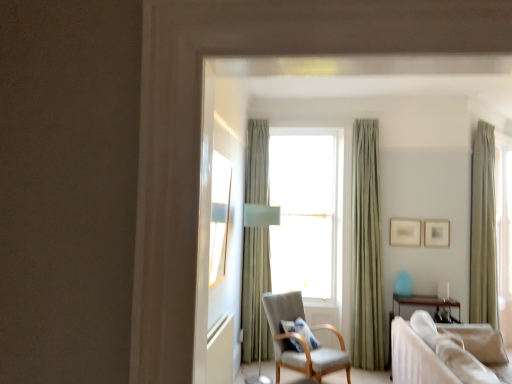
You are a GUI agent. You are given a task and a screenshot of the screen. Output one action in this format:
    pyautogui.click(x=<x>, y=<y>)
    Task: Click on the blue cotton pillow at center
    
    Given the screenshot: What is the action you would take?
    pyautogui.click(x=301, y=331)

What do you see at coordinates (301, 340) in the screenshot? I see `light gray fabric chair at center` at bounding box center [301, 340].

What is the approximate width of light gray fabric chair at center?

light gray fabric chair at center is 34.68 inches in width.

Where is `matte gold picture frame at center right, placed as the 2th picture frame when sorted from right to left`? The width and height of the screenshot is (512, 384). matte gold picture frame at center right, placed as the 2th picture frame when sorted from right to left is located at coordinates (405, 232).

This screenshot has height=384, width=512. Describe the element at coordinates (483, 229) in the screenshot. I see `green velvet curtain at right, which is the 1th curtain in right-to-left order` at that location.

You are a GUI agent. You are given a task and a screenshot of the screen. Output one action in this format:
    pyautogui.click(x=<x>, y=<y>)
    Task: Click on the teal glass vase at center-right
    This screenshot has height=384, width=512.
    Given the screenshot: What is the action you would take?
    click(x=404, y=284)

Image resolution: width=512 pixels, height=384 pixels. I want to click on sage green fabric curtain at center, acting as the 2th curtain starting from the left, so click(366, 251).

Is point (393, 341) closer to viewer compared to point (402, 224)?

Yes.

Are beige fabric couch at lower right and matte gold picture frame at center right, placed as the 2th picture frame when sorted from right to left, making contact?

No, beige fabric couch at lower right is not making contact with matte gold picture frame at center right, placed as the 2th picture frame when sorted from right to left.

Is beige fabric couch at lower right outside of matte gold picture frame at center right, which is the first picture frame from left to right?

Indeed, beige fabric couch at lower right is completely outside matte gold picture frame at center right, which is the first picture frame from left to right.

Consider the image. Based on their sizes in the image, would you say green fabric curtain at center, which ranks as the 3th curtain in right-to-left order, is bigger or smaller than light gray fabric chair at center?

green fabric curtain at center, which ranks as the 3th curtain in right-to-left order, is smaller than light gray fabric chair at center.

Considering the positions of objects green fabric curtain at center, the first curtain positioned from the left, and light gray fabric chair at center in the image provided, who is in front, green fabric curtain at center, the first curtain positioned from the left, or light gray fabric chair at center?

light gray fabric chair at center.

Can you confirm if green fabric curtain at center, which ranks as the 3th curtain in right-to-left order, is thinner than light gray fabric chair at center?

Yes.

Can you confirm if green fabric curtain at center, the first curtain positioned from the left, is shorter than light gray fabric chair at center?

Incorrect, the height of green fabric curtain at center, the first curtain positioned from the left, does not fall short of that of light gray fabric chair at center.

How much distance is there between green velvet curtain at right, which is counted as the 3th curtain, starting from the left, and blue cotton pillow at center?

green velvet curtain at right, which is counted as the 3th curtain, starting from the left, is 2.29 meters away from blue cotton pillow at center.

Is green velvet curtain at right, which is counted as the 3th curtain, starting from the left, with blue cotton pillow at center?

No, green velvet curtain at right, which is counted as the 3th curtain, starting from the left, is not beside blue cotton pillow at center.

Is point (480, 254) behind point (304, 327)?

Yes, it is.

From a real-world perspective, does green velvet curtain at right, which is the 1th curtain in right-to-left order, stand above blue cotton pillow at center?

Yes, from a real-world perspective, green velvet curtain at right, which is the 1th curtain in right-to-left order, is over blue cotton pillow at center

Does blue cotton pillow at center appear on the left side of white fabric window at center?

Correct, you'll find blue cotton pillow at center to the left of white fabric window at center.

Does blue cotton pillow at center come in front of white fabric window at center?

Yes, it is.

Is blue cotton pillow at center taller or shorter than white fabric window at center?

In the image, blue cotton pillow at center appears to be shorter than white fabric window at center.

Between blue cotton pillow at center and white fabric window at center, which one has smaller width?

white fabric window at center is thinner.

Which is more to the left, matte gold picture frame at center right, placed as the 2th picture frame when sorted from right to left, or green velvet curtain at right, which is the 1th curtain in right-to-left order?

Positioned to the left is matte gold picture frame at center right, placed as the 2th picture frame when sorted from right to left.

You are a GUI agent. You are given a task and a screenshot of the screen. Output one action in this format:
    pyautogui.click(x=<x>, y=<y>)
    Task: Click on the 2nd picture frame behind the green velvet curtain at right, which is the 1th curtain in right-to-left order, counting from the anchor's position
    This screenshot has height=384, width=512.
    Given the screenshot: What is the action you would take?
    pyautogui.click(x=405, y=232)

Is matte gold picture frame at center right, which is the first picture frame from left to right, facing towards green velvet curtain at right, which is the 1th curtain in right-to-left order?

No.

Between teal glass vase at center-right and sage green fabric curtain at center, the second curtain from the right, which one has larger width?

sage green fabric curtain at center, the second curtain from the right, is wider.

Consider the image. From a real-world perspective, does teal glass vase at center-right sit lower than sage green fabric curtain at center, the second curtain from the right?

Yes.

Can you confirm if teal glass vase at center-right is bigger than sage green fabric curtain at center, the second curtain from the right?

No.

Is teal glass vase at center-right far from sage green fabric curtain at center, acting as the 2th curtain starting from the left?

teal glass vase at center-right is actually quite close to sage green fabric curtain at center, acting as the 2th curtain starting from the left.

Does matte gold picture frame at center right, which is the first picture frame from left to right, have a greater width compared to blue cotton pillow at center?

No.

Considering the points (403, 243) and (286, 323), which point is behind, point (403, 243) or point (286, 323)?

The point (403, 243) is farther from the camera.

Looking at this image, from the image's perspective, would you say matte gold picture frame at center right, placed as the 2th picture frame when sorted from right to left, is positioned over blue cotton pillow at center?

Yes.

Is matte gold picture frame at center right, which is the first picture frame from left to right, bigger or smaller than blue cotton pillow at center?

Clearly, matte gold picture frame at center right, which is the first picture frame from left to right, is smaller in size than blue cotton pillow at center.

I want to click on studio couch that is on the right side of matte gold picture frame at center right, which is the first picture frame from left to right, so click(x=415, y=358).

The width and height of the screenshot is (512, 384). I want to click on curtain to the left of light gray fabric chair at center, so click(x=254, y=287).

Based on their spatial positions, is beige fabric couch at lower right or sage green fabric curtain at center, acting as the 2th curtain starting from the left, further from green velvet curtain at right, which is counted as the 3th curtain, starting from the left?

beige fabric couch at lower right is further to green velvet curtain at right, which is counted as the 3th curtain, starting from the left.

Which object lies further to the anchor point beige fabric couch at lower right, blue cotton pillow at center or green velvet curtain at right, which is counted as the 3th curtain, starting from the left?

green velvet curtain at right, which is counted as the 3th curtain, starting from the left, is positioned further to the anchor beige fabric couch at lower right.

Considering their positions, is green fabric curtain at center, which ranks as the 3th curtain in right-to-left order, positioned closer to matte gold picture frame at center right, placed as the 2th picture frame when sorted from right to left, than matte white picture frame at upper right, which ranks as the first picture frame in right-to-left order?

The object closer to matte gold picture frame at center right, placed as the 2th picture frame when sorted from right to left, is matte white picture frame at upper right, which ranks as the first picture frame in right-to-left order.

Which object lies nearer to the anchor point green fabric curtain at center, the first curtain positioned from the left, teal glass vase at center-right or beige fabric couch at lower right?

beige fabric couch at lower right lies closer to green fabric curtain at center, the first curtain positioned from the left, than the other object.

Looking at the image, which one is located closer to matte white picture frame at upper right, which ranks as the first picture frame in right-to-left order, green fabric curtain at center, the first curtain positioned from the left, or matte gold picture frame at center right, placed as the 2th picture frame when sorted from right to left?

matte gold picture frame at center right, placed as the 2th picture frame when sorted from right to left.

Based on their spatial positions, is green velvet curtain at right, which is the 1th curtain in right-to-left order, or white fabric window at center further from beige fabric couch at lower right?

Among the two, green velvet curtain at right, which is the 1th curtain in right-to-left order, is located further to beige fabric couch at lower right.

When comparing their distances from white fabric window at center, does light gray fabric chair at center or matte white picture frame at upper right, which ranks as the first picture frame in right-to-left order, seem further?

matte white picture frame at upper right, which ranks as the first picture frame in right-to-left order, lies further to white fabric window at center than the other object.

Estimate the real-world distances between objects in this image. Which object is closer to sage green fabric curtain at center, acting as the 2th curtain starting from the left, white fabric window at center or teal glass vase at center-right?

white fabric window at center.

The height and width of the screenshot is (384, 512). I want to click on picture frame positioned between beige fabric couch at lower right and matte gold picture frame at center right, which is the first picture frame from left to right, from near to far, so click(437, 233).

You are a GUI agent. You are given a task and a screenshot of the screen. Output one action in this format:
    pyautogui.click(x=<x>, y=<y>)
    Task: Click on the window between blue cotton pillow at center and matte white picture frame at upper right, which ranks as the first picture frame in right-to-left order, from left to right
    The image size is (512, 384).
    Given the screenshot: What is the action you would take?
    pyautogui.click(x=306, y=212)

Where is `picture frame situated between sage green fabric curtain at center, acting as the 2th curtain starting from the left, and matte white picture frame at upper right, which ranks as the first picture frame in right-to-left order, from left to right`? This screenshot has height=384, width=512. picture frame situated between sage green fabric curtain at center, acting as the 2th curtain starting from the left, and matte white picture frame at upper right, which ranks as the first picture frame in right-to-left order, from left to right is located at coordinates (405, 232).

You are a GUI agent. You are given a task and a screenshot of the screen. Output one action in this format:
    pyautogui.click(x=<x>, y=<y>)
    Task: Click on the teal situated between green fabric curtain at center, which ranks as the 3th curtain in right-to-left order, and matte white picture frame at upper right, which ranks as the first picture frame in right-to-left order, from left to right
    
    Given the screenshot: What is the action you would take?
    pyautogui.click(x=404, y=284)